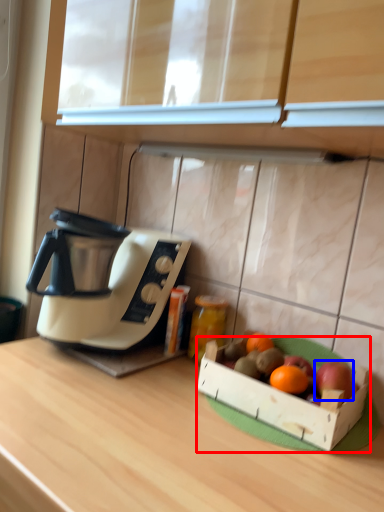
Question: Which object appears closest to the camera in this image, cardboard box (highlighted by a red box) or apple (highlighted by a blue box)?

Choices:
 (A) cardboard box
 (B) apple

Answer: (A)